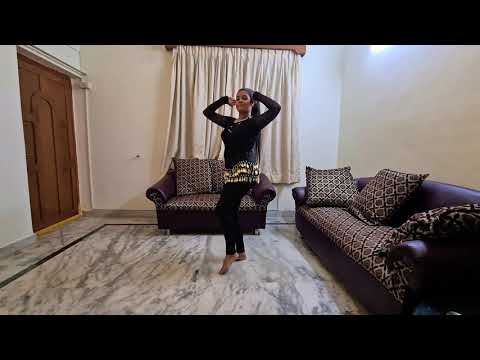
You are a GUI agent. You are given a task and a screenshot of the screen. Output one action in this format:
    pyautogui.click(x=<x>, y=<y>)
    Task: Click on the sofa
    
    Given the screenshot: What is the action you would take?
    pyautogui.click(x=340, y=260)